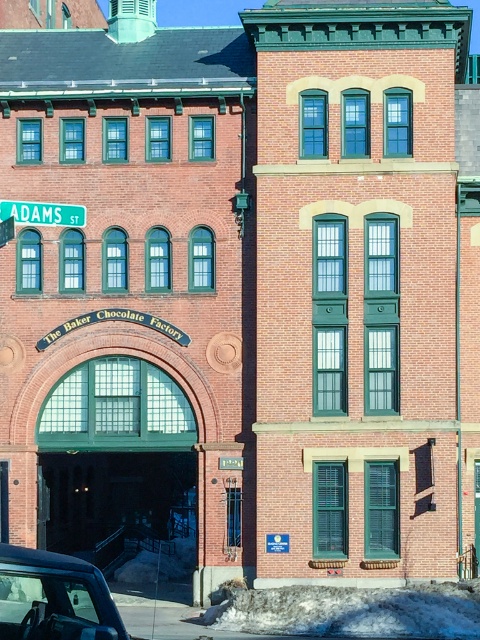
You are a delivery driver who needs to park your metallic gray car at lower left as close as possible to the green plastic street sign at upper left. According to the scene, what is the minimum distance you can get between them?

The metallic gray car at lower left is 28.88 meters from the green plastic street sign at upper left, so the closest you can park is 28.88 meters away from the sign.